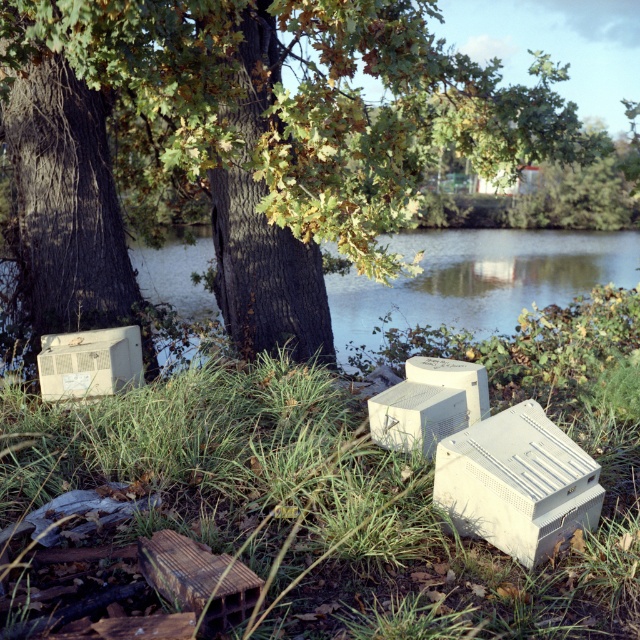
Question: Is matte brown tree trunk at center to the right of green grass at center from the viewer's perspective?

Choices:
 (A) no
 (B) yes

Answer: (A)

Question: Does matte brown tree trunk at center come behind transparent water at center?

Choices:
 (A) no
 (B) yes

Answer: (A)

Question: Estimate the real-world distances between objects in this image. Which object is farther from the transparent water at center?

Choices:
 (A) green grass at center
 (B) matte brown tree trunk at center

Answer: (A)

Question: Does matte brown tree trunk at center lie behind green grass at center?

Choices:
 (A) yes
 (B) no

Answer: (A)

Question: Which object is the closest to the green grass at center?

Choices:
 (A) transparent water at center
 (B) matte brown tree trunk at center

Answer: (B)

Question: Based on their relative distances, which object is farther from the matte brown tree trunk at center?

Choices:
 (A) transparent water at center
 (B) green grass at center

Answer: (A)